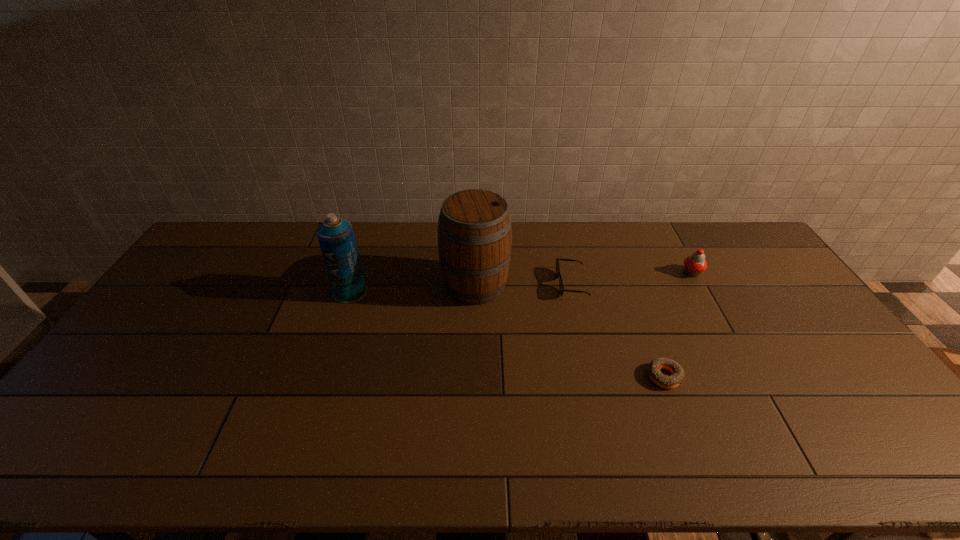
At what (x,y) coordinates should I click in order to perform the action: click on object that is the fourth closest to the leftmost object. Please return your answer as a coordinate pair (x, y). Looking at the image, I should click on (695, 264).

Find the location of a particular element. This screenshot has width=960, height=540. vacant area in the image that satisfies the following two spatial constraints: 1. on the front-facing side of the shortest object; 2. on the right side of the fourth tallest object is located at coordinates (593, 376).

This screenshot has width=960, height=540. Identify the location of vacant space that satisfies the following two spatial constraints: 1. on the front-facing side of the sunglasses; 2. on the left side of the shortest object. (593, 376).

Locate an element on the screen. The image size is (960, 540). vacant space that satisfies the following two spatial constraints: 1. on the back side of the shortest object; 2. on the front-facing side of the fourth tallest object is located at coordinates (629, 284).

You are a GUI agent. You are given a task and a screenshot of the screen. Output one action in this format:
    pyautogui.click(x=<x>, y=<y>)
    Task: Click on the vacant region that satisfies the following two spatial constraints: 1. on the front side of the nearest object; 2. on the left side of the cider
    
    Given the screenshot: What is the action you would take?
    pyautogui.click(x=474, y=376)